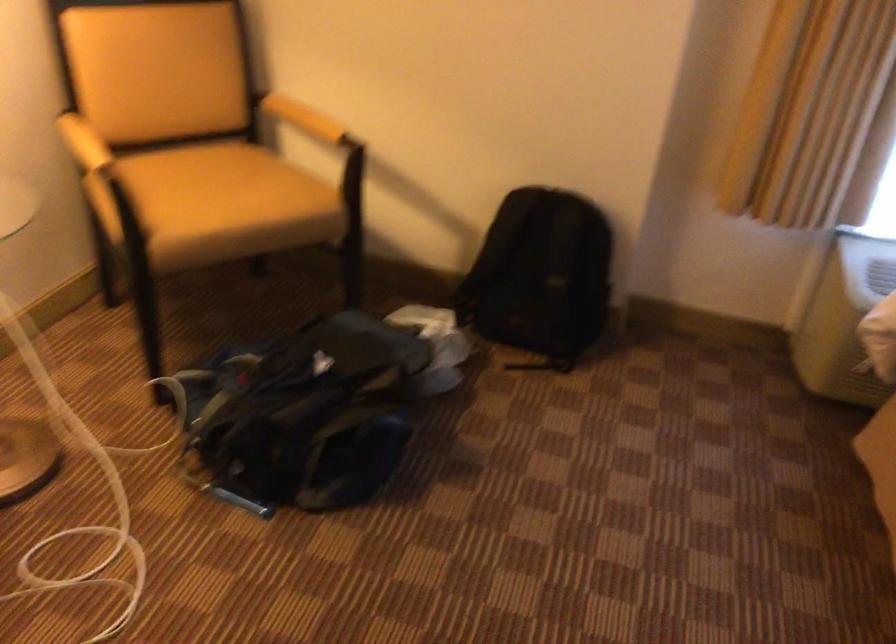
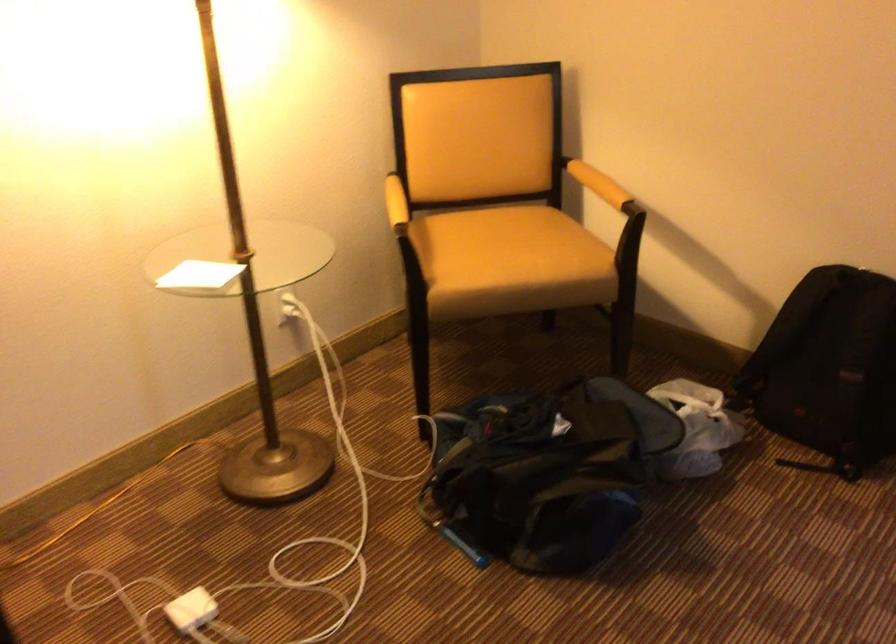
Locate, in the second image, the point that corresponds to the point at 314,116 in the first image.

(598, 184)